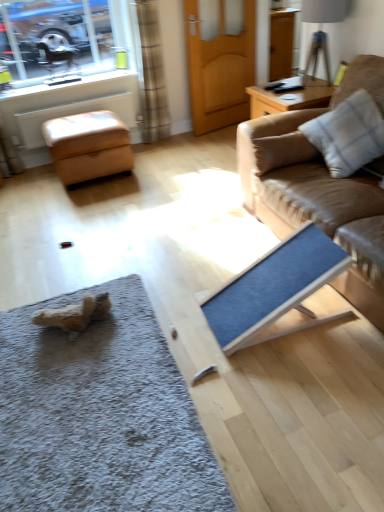
Find the location of a particular element. This screenshot has height=512, width=384. vacant space situated on the left part of leather ottoman at left is located at coordinates (31, 187).